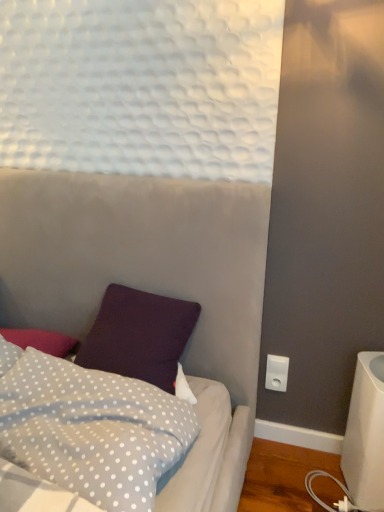
Question: Can white dotted fabric pillow at lower left be found inside white plastic electric outlet at lower right?

Choices:
 (A) no
 (B) yes

Answer: (A)

Question: Can you confirm if white plastic electric outlet at lower right is positioned to the left of white dotted fabric pillow at lower left?

Choices:
 (A) no
 (B) yes

Answer: (A)

Question: Is the depth of white plastic electric outlet at lower right greater than that of white dotted fabric pillow at lower left?

Choices:
 (A) no
 (B) yes

Answer: (B)

Question: Is white plastic electric outlet at lower right smaller than white dotted fabric pillow at lower left?

Choices:
 (A) no
 (B) yes

Answer: (B)

Question: Does white plastic electric outlet at lower right come in front of white dotted fabric pillow at lower left?

Choices:
 (A) yes
 (B) no

Answer: (B)

Question: Is white plastic electric outlet at lower right far away from white dotted fabric pillow at lower left?

Choices:
 (A) yes
 (B) no

Answer: (B)

Question: Is white dotted fabric pillow at lower left thinner than white plastic electric outlet at lower right?

Choices:
 (A) no
 (B) yes

Answer: (A)

Question: Is white dotted fabric pillow at lower left in front of white plastic electric outlet at lower right?

Choices:
 (A) yes
 (B) no

Answer: (A)

Question: Is white dotted fabric pillow at lower left smaller than white plastic electric outlet at lower right?

Choices:
 (A) no
 (B) yes

Answer: (A)

Question: Would you say white dotted fabric pillow at lower left contains white plastic electric outlet at lower right?

Choices:
 (A) yes
 (B) no

Answer: (B)

Question: Are white dotted fabric pillow at lower left and white plastic electric outlet at lower right far apart?

Choices:
 (A) yes
 (B) no

Answer: (B)

Question: Considering the relative sizes of white dotted fabric pillow at lower left and white plastic electric outlet at lower right in the image provided, is white dotted fabric pillow at lower left shorter than white plastic electric outlet at lower right?

Choices:
 (A) no
 (B) yes

Answer: (A)

Question: Considering the positions of white dotted fabric pillow at lower left and white plastic electric outlet at lower right in the image, is white dotted fabric pillow at lower left taller or shorter than white plastic electric outlet at lower right?

Choices:
 (A) short
 (B) tall

Answer: (B)